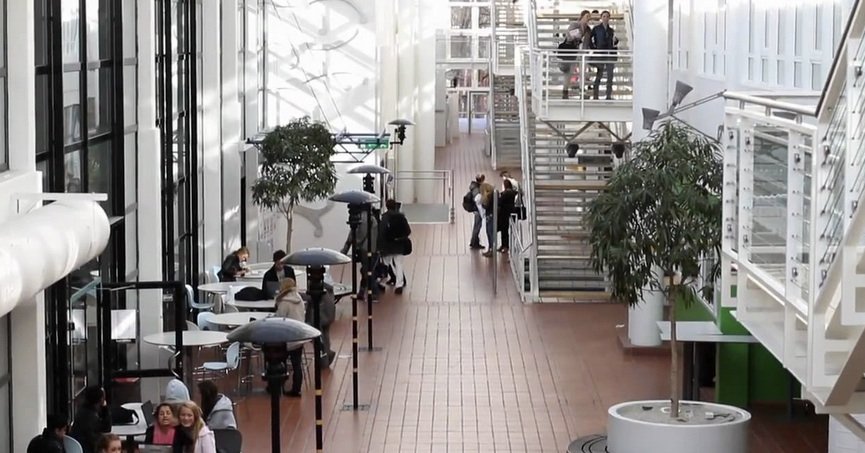
Image resolution: width=865 pixels, height=453 pixels. I want to click on light fixture, so 278,344, 314,266, 362,202, 368,172, 402,127.